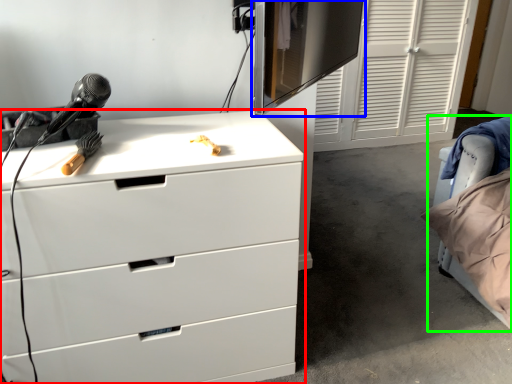
Question: Estimate the real-world distances between objects in this image. Which object is closer to chest of drawers (highlighted by a red box), computer monitor (highlighted by a blue box) or bed (highlighted by a green box)?

Choices:
 (A) computer monitor
 (B) bed

Answer: (B)